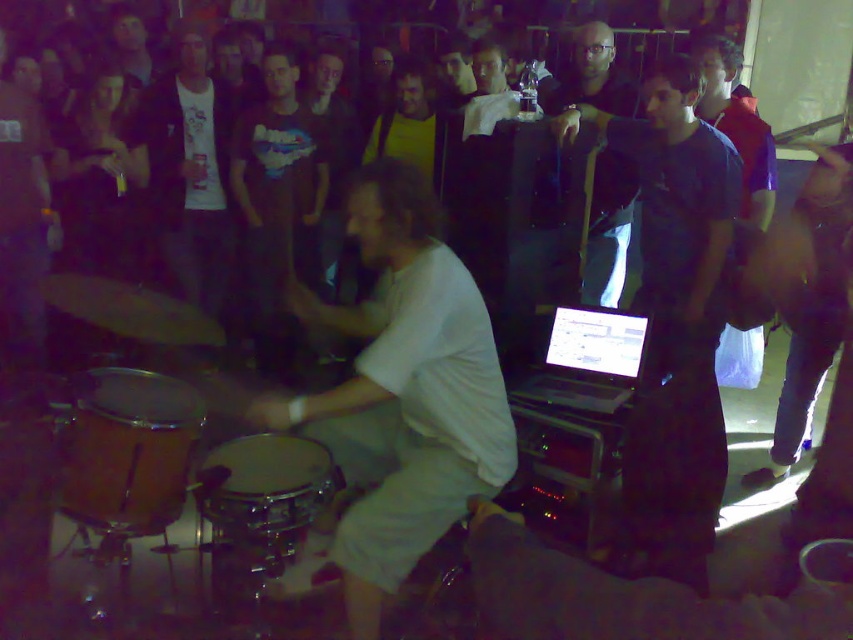
You are a photographer at the live music performance. You want to capture a clear photo of the drummer without any obstructions. Based on the scene, is the white matte shirt at center blocking the view of the wooden drum at center?

The white matte shirt at center is positioned over wooden drum at center, so it is blocking the view of the wooden drum at center.

You are a photographer taking a photo of the drummer and his equipment. You notice the white matte shirt at center and the wooden drum at center. Which object should you focus on if you want to capture the larger one in your shot?

The white matte shirt at center is bigger than the wooden drum at center, so you should focus on the white matte shirt at center to capture the larger one in your shot.